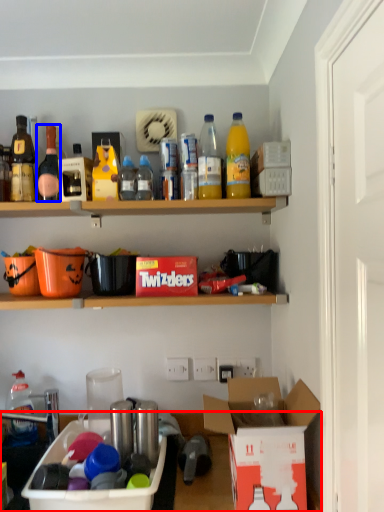
Question: Which object is further to the camera taking this photo, desk (highlighted by a red box) or bottle (highlighted by a blue box)?

Choices:
 (A) desk
 (B) bottle

Answer: (B)